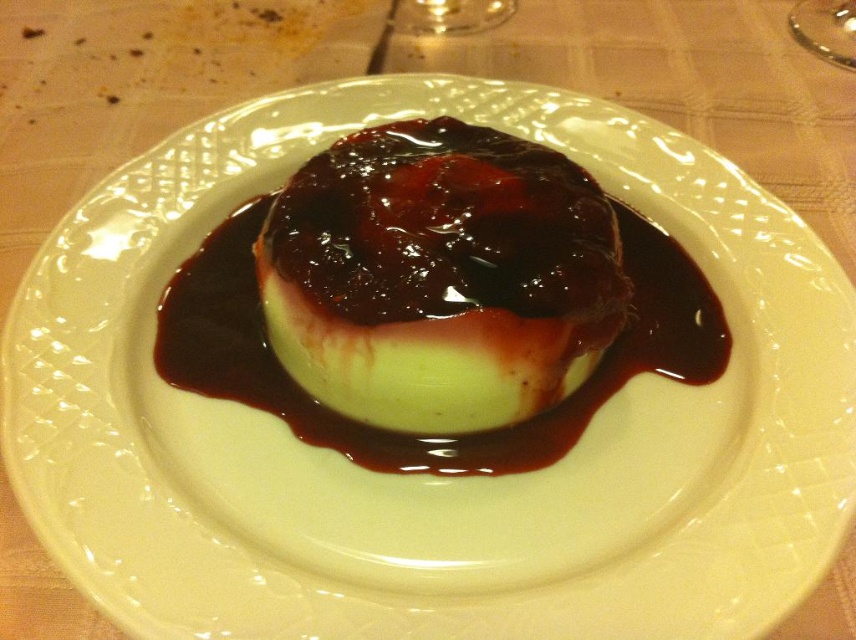
Does white creamy pudding at center have a greater height compared to transparent glass at upper right?

Yes, white creamy pudding at center is taller than transparent glass at upper right.

In the scene shown: Is white creamy pudding at center to the right of transparent glass at upper right from the viewer's perspective?

No, white creamy pudding at center is not to the right of transparent glass at upper right.

This screenshot has width=856, height=640. What do you see at coordinates (438, 276) in the screenshot? I see `white creamy pudding at center` at bounding box center [438, 276].

Locate an element on the screen. white creamy pudding at center is located at coordinates coord(438,276).